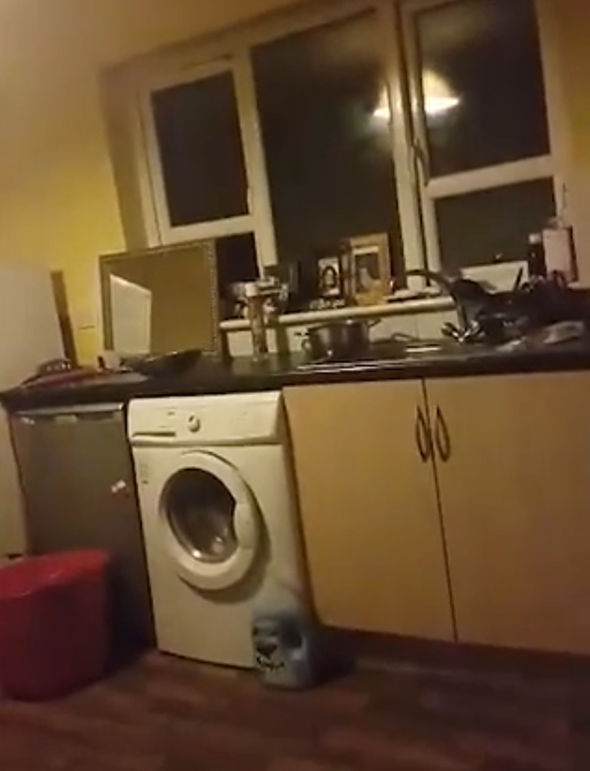
The width and height of the screenshot is (590, 771). In order to click on yellow wall in this screenshot , I will do `click(42, 139)`.